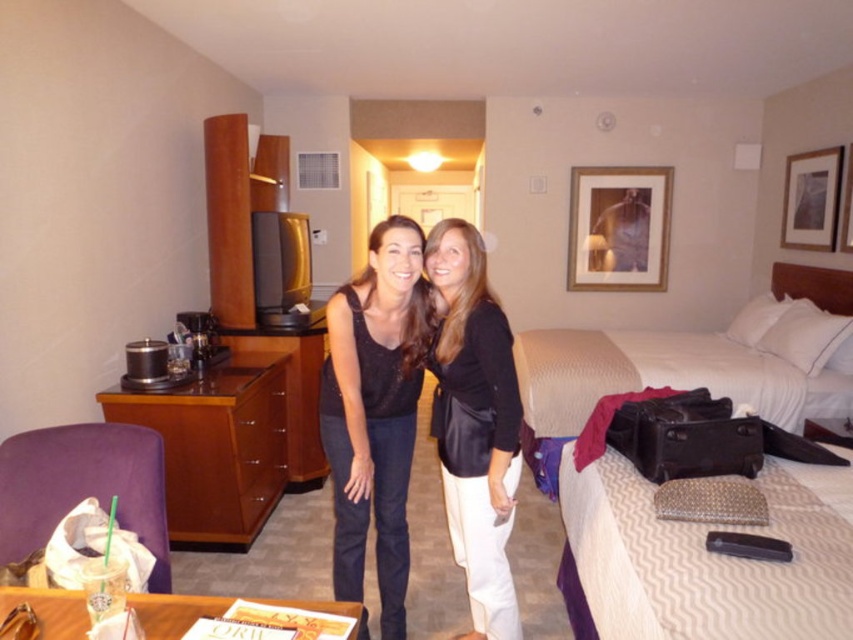
Who is lower down, black leather jacket at center or white textured bed at center?

black leather jacket at center is lower down.

Which of these two, black leather jacket at center or white textured bed at center, stands shorter?

Standing shorter between the two is white textured bed at center.

Between point (498, 576) and point (573, 611), which one is positioned in front?

Point (498, 576) is in front.

This screenshot has width=853, height=640. What are the coordinates of `black leather jacket at center` in the screenshot? It's located at (474, 424).

Which is in front, point (418, 324) or point (577, 580)?

Positioned in front is point (418, 324).

Who is more forward, (318, 410) or (840, 276)?

Point (318, 410) is in front.

The image size is (853, 640). Find the location of `matte black tank top at center`. matte black tank top at center is located at coordinates (375, 410).

Is matte black tank top at center bigger than black leather jacket at center?

Yes, matte black tank top at center is bigger than black leather jacket at center.

Based on the photo, does matte black tank top at center appear on the left side of black leather jacket at center?

Indeed, matte black tank top at center is positioned on the left side of black leather jacket at center.

This screenshot has height=640, width=853. What are the coordinates of `matte black tank top at center` in the screenshot? It's located at (375, 410).

Identify the location of matte black tank top at center. (375, 410).